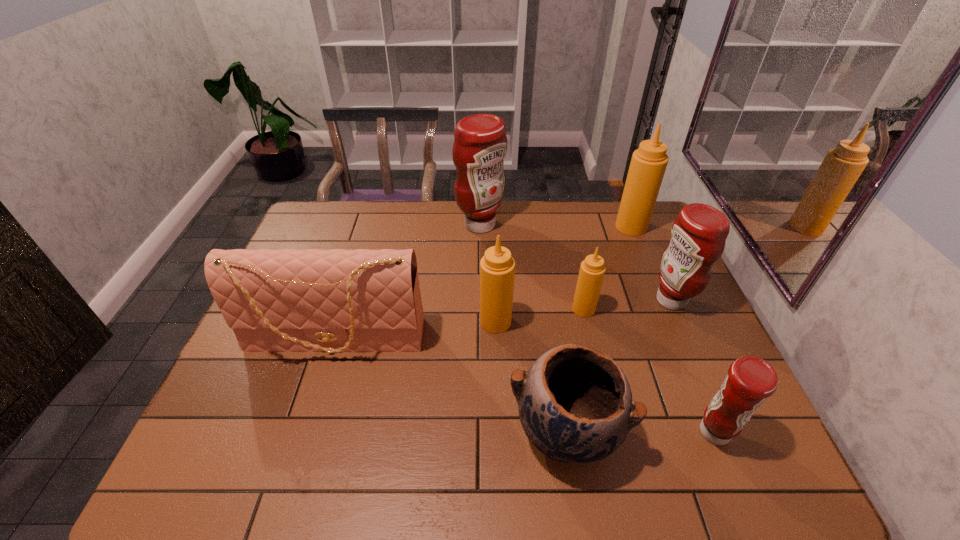
At what (x,y) coordinates should I click in order to perform the action: click on the biggest red condiment. Please return your answer as a coordinate pair (x, y). Looking at the image, I should click on (480, 143).

Where is `the farthest red condiment`? the farthest red condiment is located at coordinates (480, 143).

You are a GUI agent. You are given a task and a screenshot of the screen. Output one action in this format:
    pyautogui.click(x=<x>, y=<y>)
    Task: Click on the farthest tan condiment
    
    Given the screenshot: What is the action you would take?
    pyautogui.click(x=648, y=164)

Where is `the rightmost tan condiment`? the rightmost tan condiment is located at coordinates (648, 164).

Find the location of a particular element. This screenshot has height=540, width=960. the second smallest red condiment is located at coordinates (698, 236).

Locate an element on the screen. the second biggest tan condiment is located at coordinates coord(497,268).

Where is `handbag`? The image size is (960, 540). handbag is located at coordinates (289, 300).

I want to click on the leftmost object, so pyautogui.click(x=289, y=300).

Locate an element on the screen. the third condiment from left to right is located at coordinates (592, 270).

What are the coordinates of `the second tan condiment from right to left` in the screenshot? It's located at (592, 270).